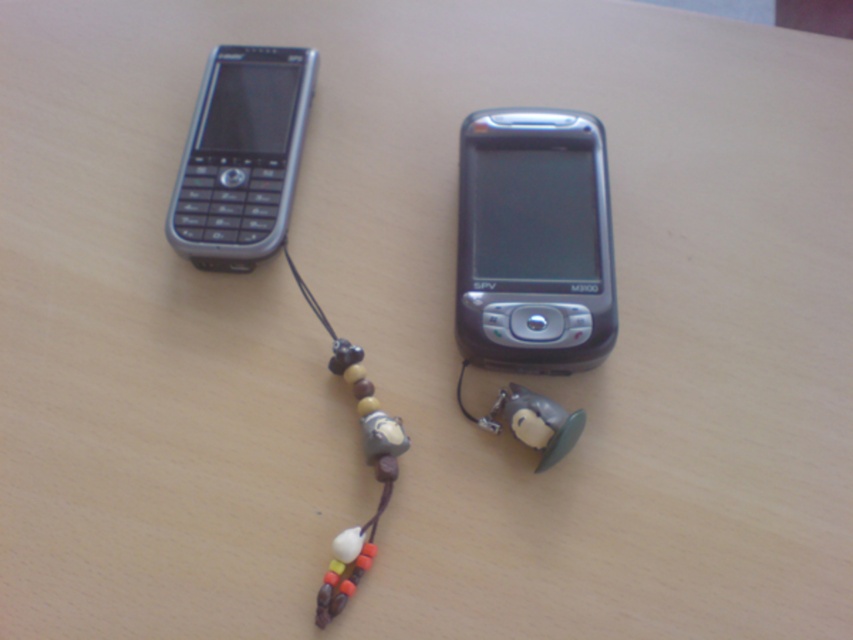
You are standing in front of two phones on a table. You notice two points marked on the scene. The first point is at coordinates point [554,154] and the second point is at point [363,397]. Which point is closer to you?

Point [554,154] is closer to you because it is further to the viewer than point [363,397].

You are trying to place both the slate gray plastic smartphone at center and the silver metallic phone at upper left into a rectangular phone case that can only fit the larger of the two. Which phone should you choose to fit into the case?

The slate gray plastic smartphone at center is bigger than the silver metallic phone at upper left, so you should choose the slate gray plastic smartphone at center to fit into the case.